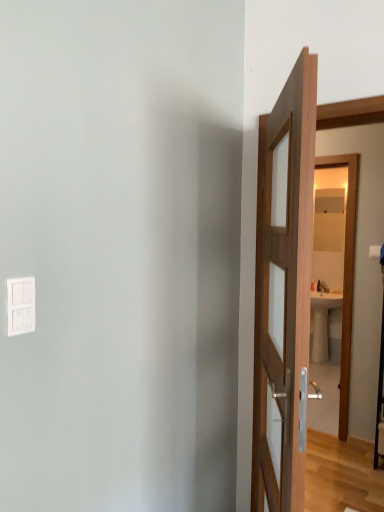
Find the location of a particular element. Image resolution: width=384 pixels, height=512 pixels. white plastic light switch at upper left is located at coordinates (20, 305).

Image resolution: width=384 pixels, height=512 pixels. Describe the element at coordinates (20, 305) in the screenshot. I see `white plastic light switch at upper left` at that location.

Identify the location of white plastic light switch at upper left. (20, 305).